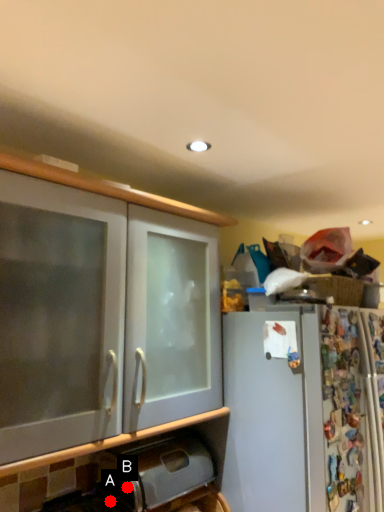
Question: Two points are circled on the image, labeled by A and B beside each circle. Which point appears closest to the camera in this image?

Choices:
 (A) A is closer
 (B) B is closer

Answer: (A)